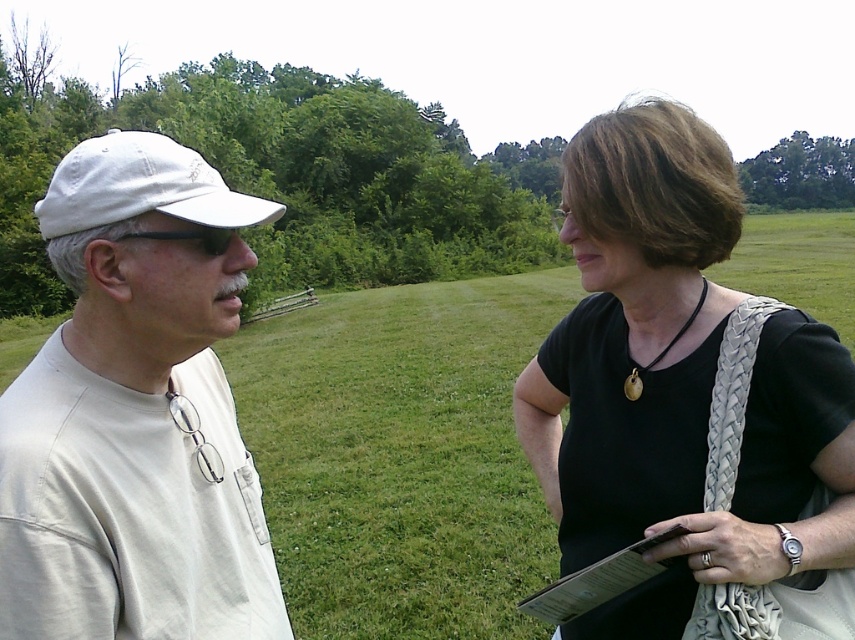
Who is shorter, white matte cap at left or white fabric baseball cap at left?

white matte cap at left

Is white matte cap at left bigger than white fabric baseball cap at left?

Incorrect, white matte cap at left is not larger than white fabric baseball cap at left.

This screenshot has width=855, height=640. In order to click on white matte cap at left in this screenshot , I will do `click(134, 413)`.

What are the coordinates of `white matte cap at left` in the screenshot? It's located at (134, 413).

Can you confirm if white matte cap at left is bigger than black woven purse at right?

Actually, white matte cap at left might be smaller than black woven purse at right.

Who is taller, white matte cap at left or black woven purse at right?

With more height is black woven purse at right.

Between point (115, 582) and point (590, 340), which one is positioned in front?

Point (115, 582) is more forward.

The height and width of the screenshot is (640, 855). Identify the location of white matte cap at left. (134, 413).

Between black woven purse at right and white fabric baseball cap at left, which one has more height?

white fabric baseball cap at left

Can you confirm if black woven purse at right is smaller than white fabric baseball cap at left?

Indeed, black woven purse at right has a smaller size compared to white fabric baseball cap at left.

Which is in front, point (665, 397) or point (186, 212)?

Point (186, 212) is more forward.

Where is `black woven purse at right`? black woven purse at right is located at coordinates (676, 380).